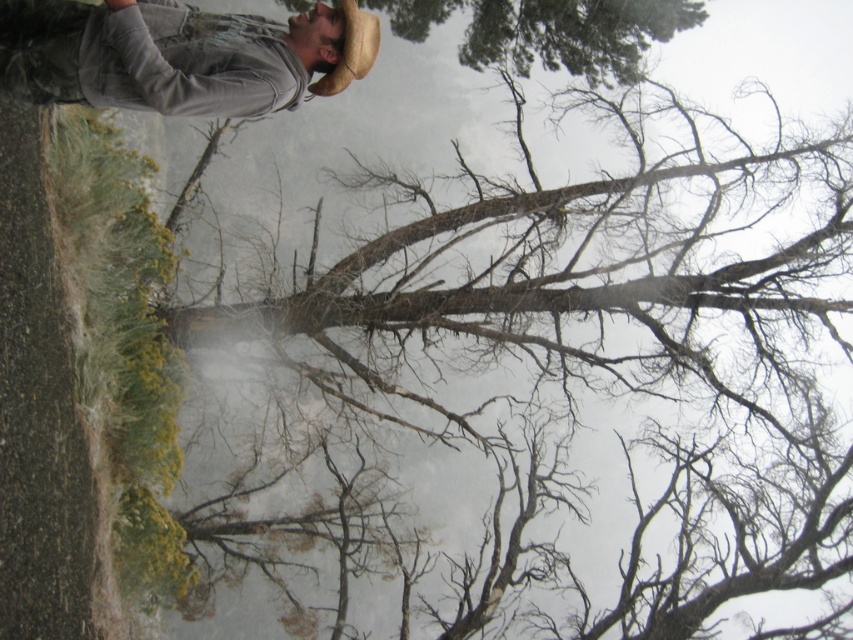
Between gray fabric jacket at upper left and braided straw cowboy hat at upper center, which one has less height?

braided straw cowboy hat at upper center

Does gray fabric jacket at upper left appear under braided straw cowboy hat at upper center?

Indeed, gray fabric jacket at upper left is positioned under braided straw cowboy hat at upper center.

Who is more distant from viewer, (15, 36) or (346, 19)?

Point (346, 19)

The image size is (853, 640). What are the coordinates of `gray fabric jacket at upper left` in the screenshot? It's located at (178, 54).

Does bare branches at upper center come in front of braided straw cowboy hat at upper center?

No, it is behind braided straw cowboy hat at upper center.

Measure the distance between bare branches at upper center and camera.

bare branches at upper center is 20.58 meters away from camera.

Where is `bare branches at upper center`? This screenshot has width=853, height=640. bare branches at upper center is located at coordinates pyautogui.click(x=573, y=374).

Between point (608, 173) and point (144, 84), which one is positioned in front?

Positioned in front is point (144, 84).

Is point (350, 552) positioned after point (143, 64)?

Yes, point (350, 552) is behind point (143, 64).

Who is more distant from viewer, [815,180] or [206,54]?

Positioned behind is point [815,180].

Where is `bare branches at upper center`? The width and height of the screenshot is (853, 640). bare branches at upper center is located at coordinates (573, 374).